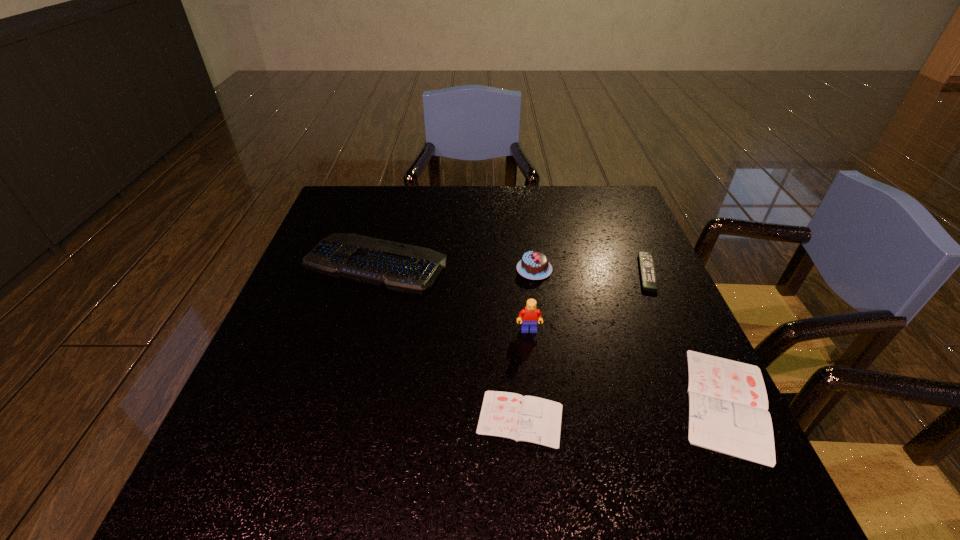
The image size is (960, 540). I want to click on free region located 0.270m on the left of the taller diary, so click(533, 402).

At what (x,y) coordinates should I click in order to perform the action: click on free point located 0.320m on the back of the chocolate cake. Please return your answer as a coordinate pair (x, y). This screenshot has height=540, width=960. Looking at the image, I should click on (524, 197).

I want to click on vacant position located 0.190m on the back of the leftmost object, so click(393, 200).

You are a GUI agent. You are given a task and a screenshot of the screen. Output one action in this format:
    pyautogui.click(x=<x>, y=<y>)
    Task: Click on the vacant space located 0.330m on the left of the remote control
    
    Given the screenshot: What is the action you would take?
    pyautogui.click(x=507, y=273)

The height and width of the screenshot is (540, 960). In order to click on free point located 0.100m on the face of the fourth farthest object in this screenshot , I will do `click(534, 370)`.

Where is `object at the left edge`? object at the left edge is located at coordinates (397, 266).

At what (x,y) coordinates should I click in order to perform the action: click on diary situated at the right edge. Please return your answer as a coordinate pair (x, y). The width and height of the screenshot is (960, 540). Looking at the image, I should click on (728, 406).

Identify the location of remote control located at the right edge. (646, 260).

Find the location of a particular element. This screenshot has height=540, width=960. object situated at the near right corner is located at coordinates (728, 406).

The image size is (960, 540). Find the location of `free space at the far edge`. free space at the far edge is located at coordinates (493, 213).